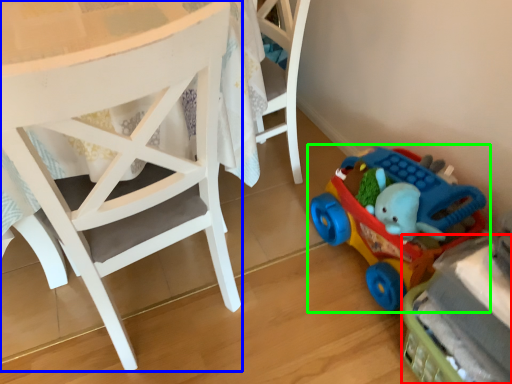
Question: Considering the real-world distances, which object is farthest from toy (highlighted by a red box)? chair (highlighted by a blue box) or toy (highlighted by a green box)?

Choices:
 (A) chair
 (B) toy

Answer: (A)